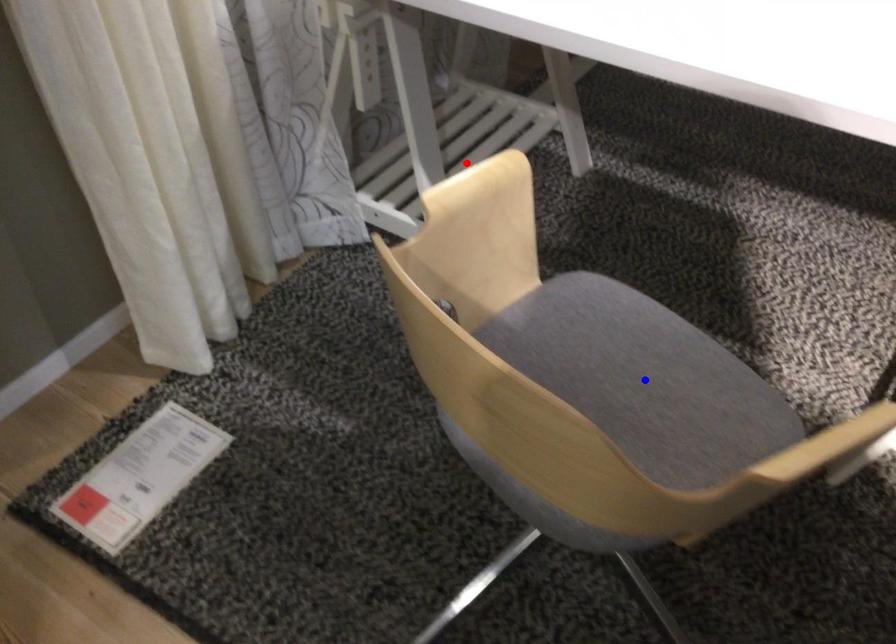
Question: Two points are marked on the image. Which point is closer to the camera?

Choices:
 (A) Blue point is closer.
 (B) Red point is closer.

Answer: (A)